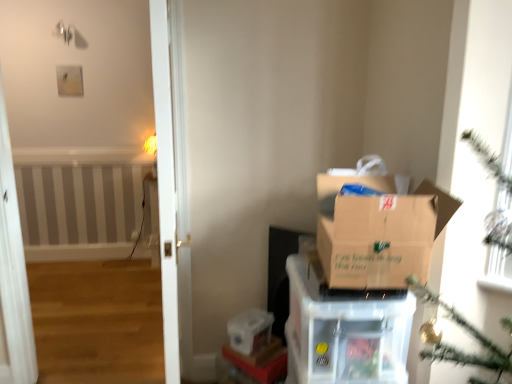
The image size is (512, 384). I want to click on free space above clear plastic container at lower center (from a real-world perspective), so click(x=265, y=350).